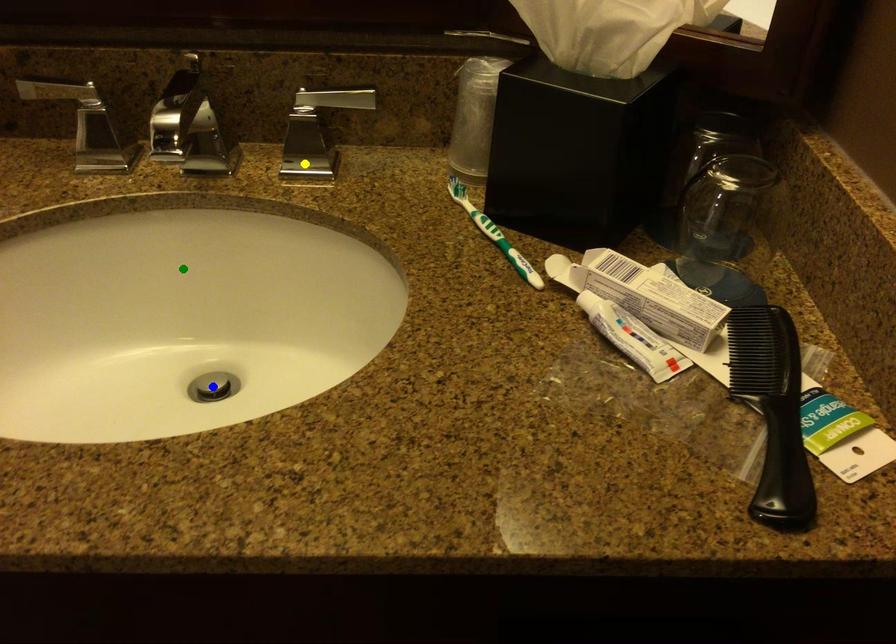
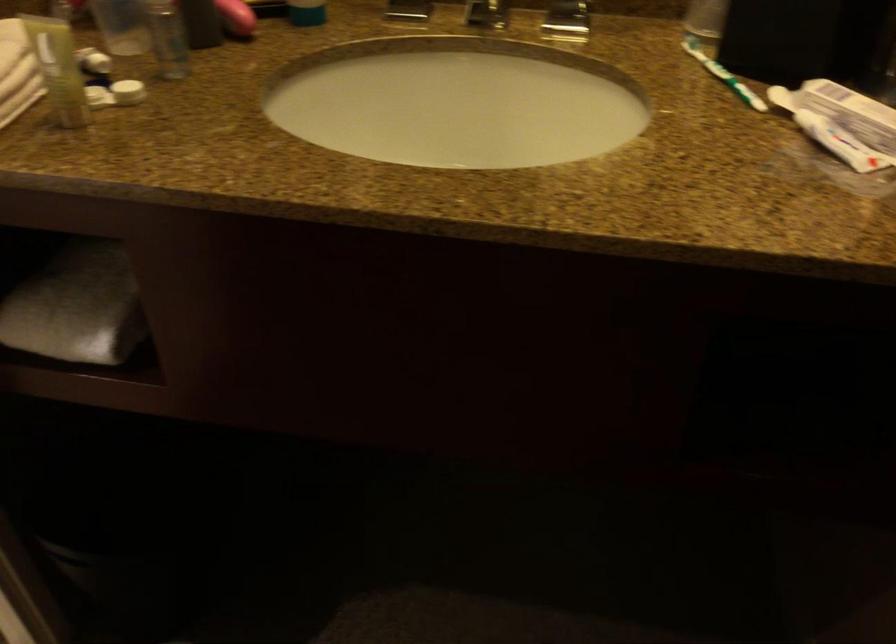
I am providing you with two images of the same scene from different viewpoints. Three points are marked in image1. Which point corresponds to a part or object that is occluded in image2?In image1, three points are marked. Which of them correspond to a part or object that is occluded in image2?Among the three points shown in image1, which one corresponds to a part or object that is no longer visible due to occlusion in image2?

blue point